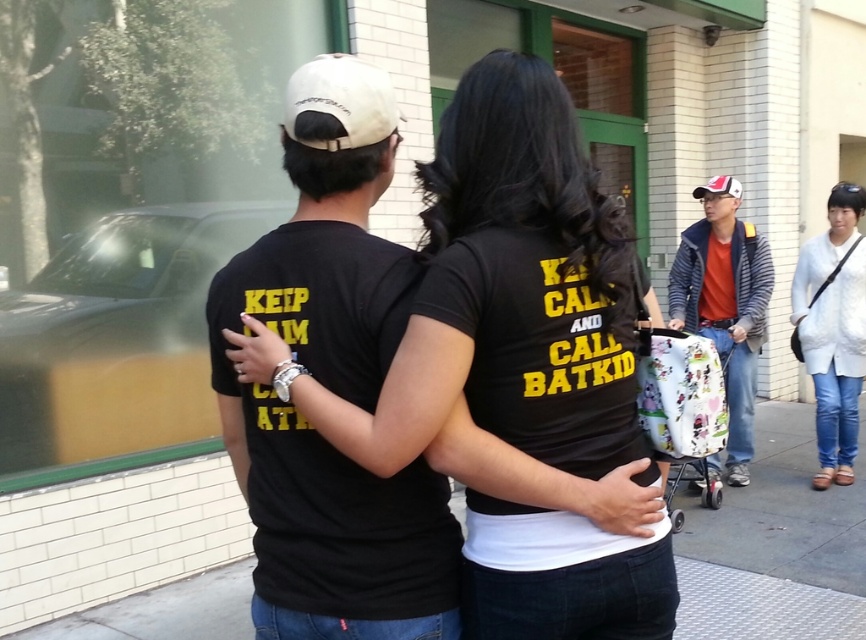
You are a delivery person who needs to place a small package on the gray concrete sidewalk at center and a large package on the orange cotton shirt at right. Which object can accommodate its corresponding package based on their sizes?

The gray concrete sidewalk at center is smaller than the orange cotton shirt at right, so the small package should be placed on the gray concrete sidewalk at center and the large package on the orange cotton shirt at right.